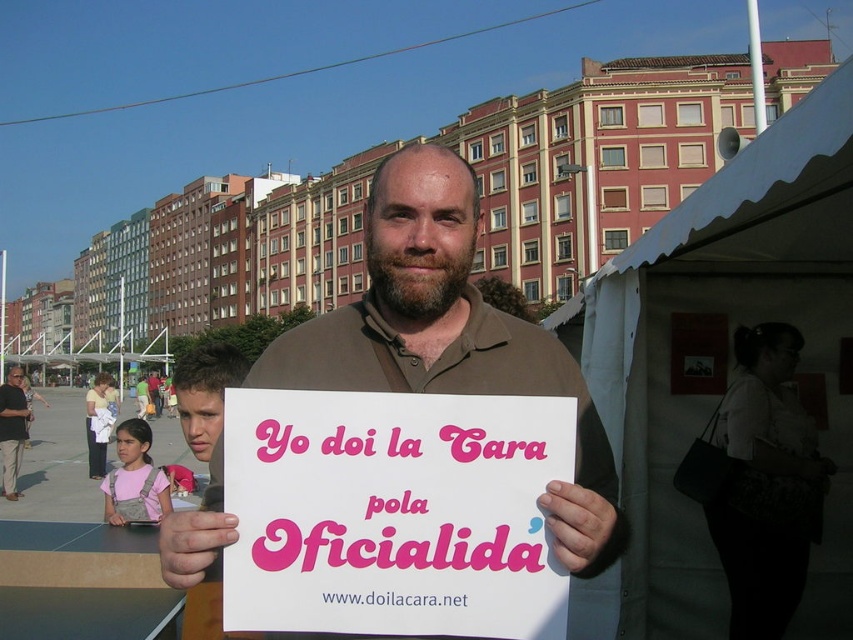
Consider the image. You are a photographer trying to capture the man holding the pink paper sign at center and the brown cotton shirt at center. Since the sign is smaller than the shirt, which object should you focus on to ensure it is clearly visible in your photo?

The pink paper sign at center is smaller than the brown cotton shirt at center, so you should focus on the pink paper sign at center to ensure it is clearly visible in your photo.

You are a photographer trying to capture the brown cotton shirt at center and the matte black shirt at lower left in the same frame. Can you position yourself so that both shirts are visible without one blocking the other?

The brown cotton shirt at center is positioned over the matte black shirt at lower left, so the brown cotton shirt at center will block the matte black shirt at lower left. Therefore, it is not possible to position yourself to see both shirts without one blocking the other.

You are designing a poster for an event and want to ensure the text is visible. Given that the pink paper sign at center and the brown cotton shirt at center are both in the foreground, which object has a smaller width to help with layout planning?

The pink paper sign at center has a smaller width than the brown cotton shirt at center, so it would be the better choice for a compact layout.